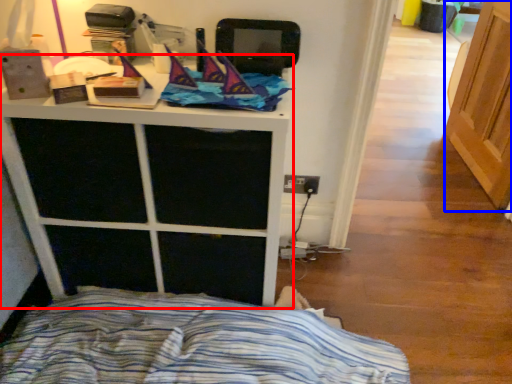
Question: Which of the following is the farthest to the observer, furniture (highlighted by a red box) or screen door (highlighted by a blue box)?

Choices:
 (A) furniture
 (B) screen door

Answer: (B)